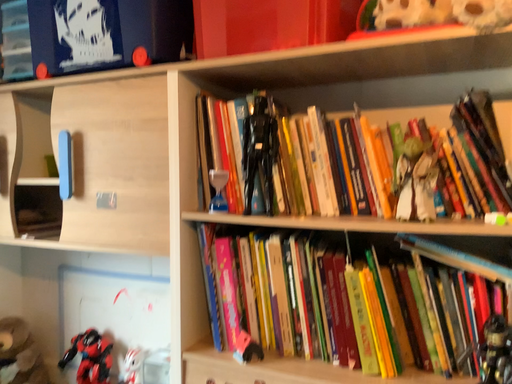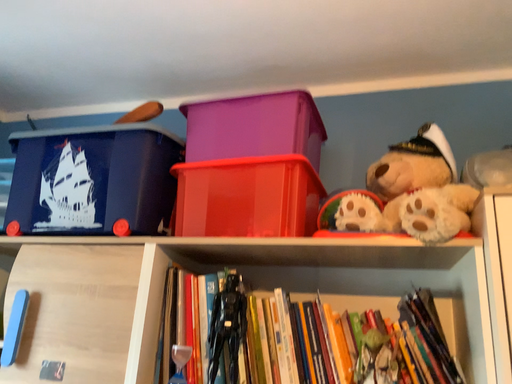
Question: How did the camera likely rotate when shooting the video?

Choices:
 (A) rotated downward
 (B) rotated upward

Answer: (B)